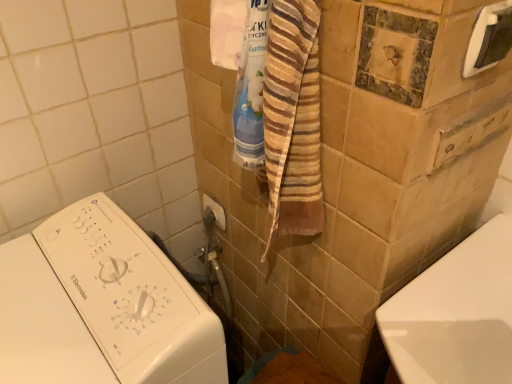
Question: From the image's perspective, is white plastic washing machine at left beneath white plastic towel bar at upper right, which ranks as the second towel bar in bottom-to-top order?

Choices:
 (A) yes
 (B) no

Answer: (A)

Question: Is white plastic washing machine at left located outside white plastic towel bar at upper right, which ranks as the second towel bar in bottom-to-top order?

Choices:
 (A) yes
 (B) no

Answer: (A)

Question: Is the depth of white plastic washing machine at left greater than that of white plastic towel bar at upper right, which is the second towel bar in left-to-right order?

Choices:
 (A) no
 (B) yes

Answer: (A)

Question: Is white plastic towel bar at upper right, marked as the 1th towel bar in a right-to-left arrangement, located within white plastic washing machine at left?

Choices:
 (A) no
 (B) yes

Answer: (A)

Question: Is white plastic washing machine at left not close to white plastic towel bar at upper right, acting as the first towel bar starting from the front?

Choices:
 (A) yes
 (B) no

Answer: (B)

Question: Is white plastic washing machine at left closer to the viewer compared to white plastic towel bar at upper right, which is the second towel bar in left-to-right order?

Choices:
 (A) no
 (B) yes

Answer: (B)

Question: Can you confirm if metallic silver towel bar at upper center, the first towel bar in the back-to-front sequence, is shorter than white plastic towel bar at upper right, the 1th towel bar when ordered from top to bottom?

Choices:
 (A) no
 (B) yes

Answer: (B)

Question: Is metallic silver towel bar at upper center, which is counted as the 2th towel bar, starting from the front, oriented towards white plastic towel bar at upper right, marked as the 1th towel bar in a right-to-left arrangement?

Choices:
 (A) yes
 (B) no

Answer: (B)

Question: Is metallic silver towel bar at upper center, which appears as the first towel bar when ordered from the bottom, positioned in front of white plastic towel bar at upper right, which is the second towel bar in left-to-right order?

Choices:
 (A) yes
 (B) no

Answer: (B)

Question: From a real-world perspective, is metallic silver towel bar at upper center, which is counted as the 2th towel bar, starting from the front, on top of white plastic towel bar at upper right, marked as the 1th towel bar in a right-to-left arrangement?

Choices:
 (A) no
 (B) yes

Answer: (A)

Question: Can you confirm if metallic silver towel bar at upper center, placed as the 2th towel bar when sorted from right to left, is thinner than white plastic towel bar at upper right, the 1th towel bar when ordered from top to bottom?

Choices:
 (A) no
 (B) yes

Answer: (A)

Question: Could white plastic towel bar at upper right, the 1th towel bar when ordered from top to bottom, be considered to be inside metallic silver towel bar at upper center, which appears as the first towel bar when ordered from the bottom?

Choices:
 (A) yes
 (B) no

Answer: (B)

Question: Is metallic silver towel bar at upper center, positioned as the 2th towel bar in top-to-bottom order, positioned behind white plastic washing machine at left?

Choices:
 (A) yes
 (B) no

Answer: (A)